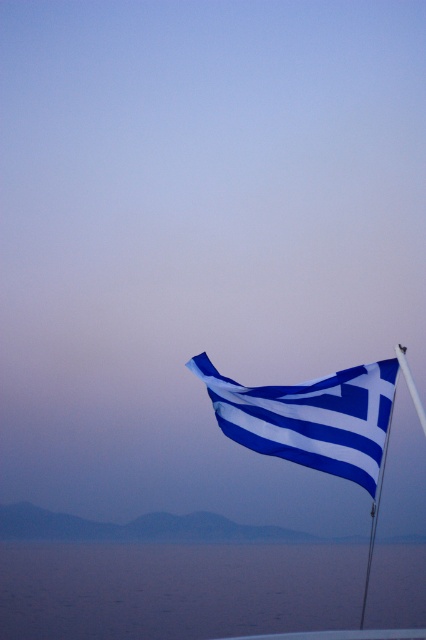
Which is above, blue/white striped flag at center or metallic silver flag pole at right?

blue/white striped flag at center is higher up.

Consider the image. Is blue/white striped flag at center taller than metallic silver flag pole at right?

No, blue/white striped flag at center is not taller than metallic silver flag pole at right.

The width and height of the screenshot is (426, 640). Describe the element at coordinates (310, 417) in the screenshot. I see `blue/white striped flag at center` at that location.

Find the location of a particular element. blue/white striped flag at center is located at coordinates (310, 417).

Can you confirm if metallic silver flag pole at right is thinner than metallic pole at right?

Indeed, metallic silver flag pole at right has a lesser width compared to metallic pole at right.

Is point (386, 376) positioned after point (397, 342)?

No.

Between point (370, 556) and point (406, 369), which one is positioned in front?

Point (406, 369) is in front.

This screenshot has width=426, height=640. I want to click on metallic silver flag pole at right, so click(x=380, y=460).

You are a GUI agent. You are given a task and a screenshot of the screen. Output one action in this format:
    pyautogui.click(x=<x>, y=<y>)
    Task: Click on the blue water at lower center
    The image size is (426, 640).
    Given the screenshot: What is the action you would take?
    pyautogui.click(x=176, y=589)

Where is `blue water at lower center`? This screenshot has height=640, width=426. blue water at lower center is located at coordinates (176, 589).